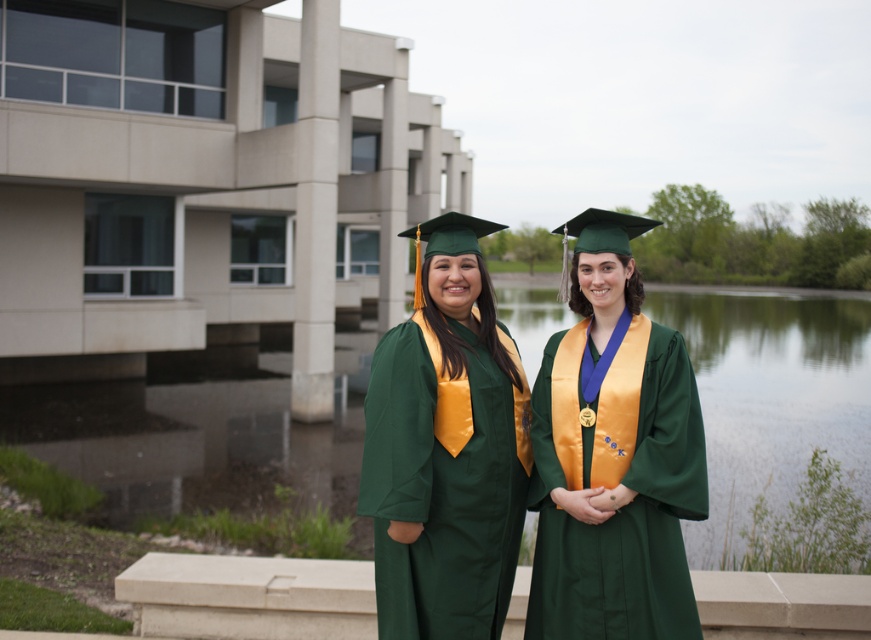
You are a photographer at a graduation ceremony. You need to arrange two graduates wearing the green satin graduation gown at center and the green matte graduation gown at center so that both gowns are visible in the photo. Given their sizes, which gown should be placed closer to the camera to ensure both are fully visible?

The green satin graduation gown at center is smaller than the green matte graduation gown at center. To ensure both are fully visible, the larger green matte graduation gown at center should be placed closer to the camera so its size doesn not overpower the smaller one.

You are a photographer trying to capture a clear shot of the green satin graduation gown at center. Based on its position at coordinates 0.714, 0.705, can you confirm if it is positioned centrally within the frame?

The green satin graduation gown at center is located at point (613, 456), which means it is positioned centrally within the frame.

You are a photographer trying to capture a closeup shot of both graduation gowns. The camera you are using has a maximum focus range of 15 inches. Based on the scene, can you fit both the green satin graduation gown at center and the green matte graduation gown at center in the same frame without moving the camera?

The distance between the green satin graduation gown at center and the green matte graduation gown at center is 15.77 inches. Since the camera can only focus up to 15 inches, the two gowns are slightly out of the camera range. You might need to adjust the camera settings or move closer to ensure both are in focus.